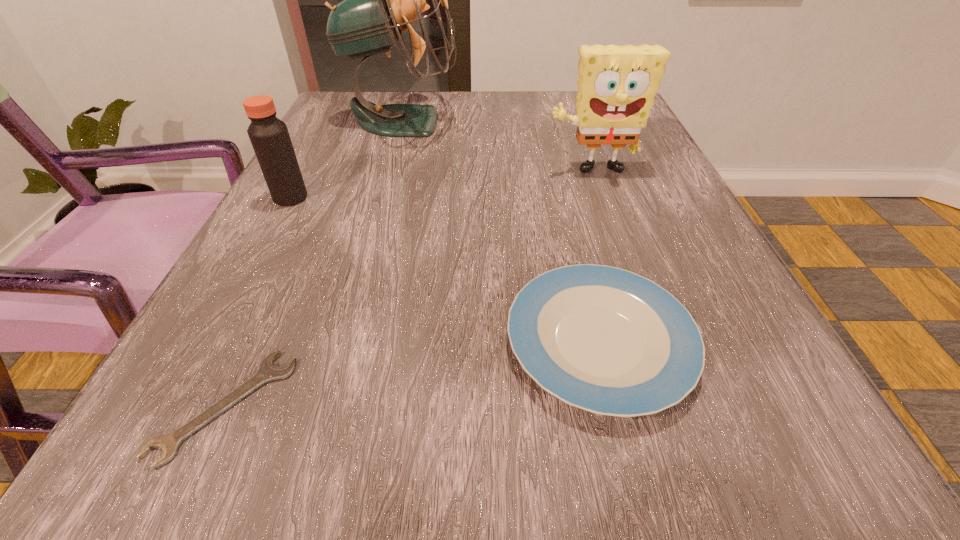
The height and width of the screenshot is (540, 960). I want to click on free location that satisfies the following two spatial constraints: 1. on the back side of the plate; 2. on the right side of the wrench, so click(x=254, y=343).

Find the location of a particular element. The height and width of the screenshot is (540, 960). free space that satisfies the following two spatial constraints: 1. on the back side of the plate; 2. on the right side of the shortest object is located at coordinates (254, 343).